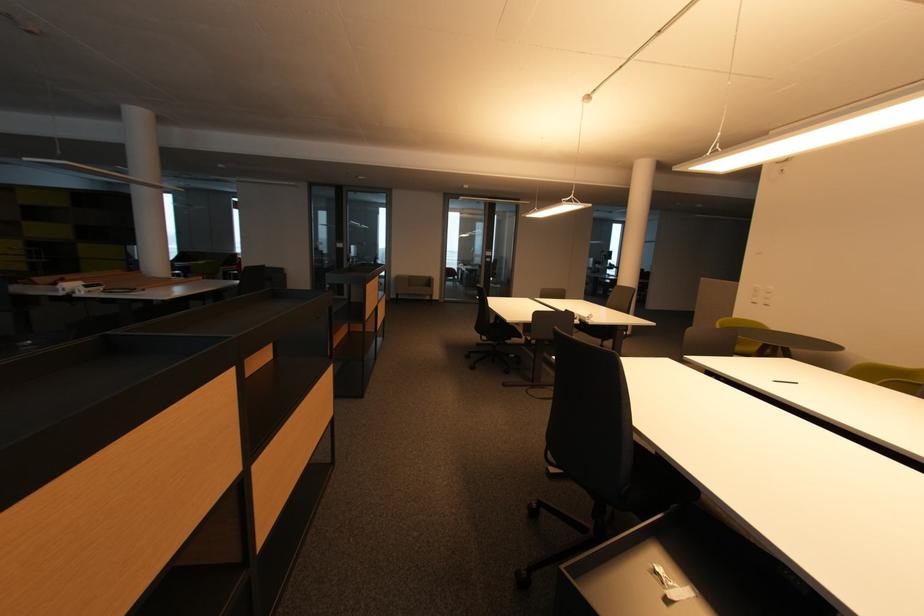
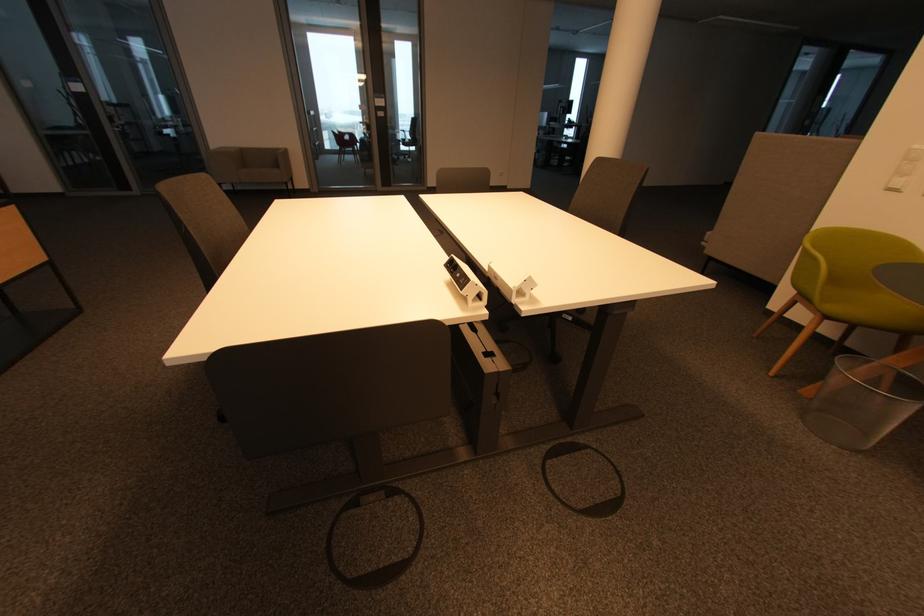
The images are taken continuously from a first-person perspective. In which direction are you moving?

The cameraman moved toward right, forward.